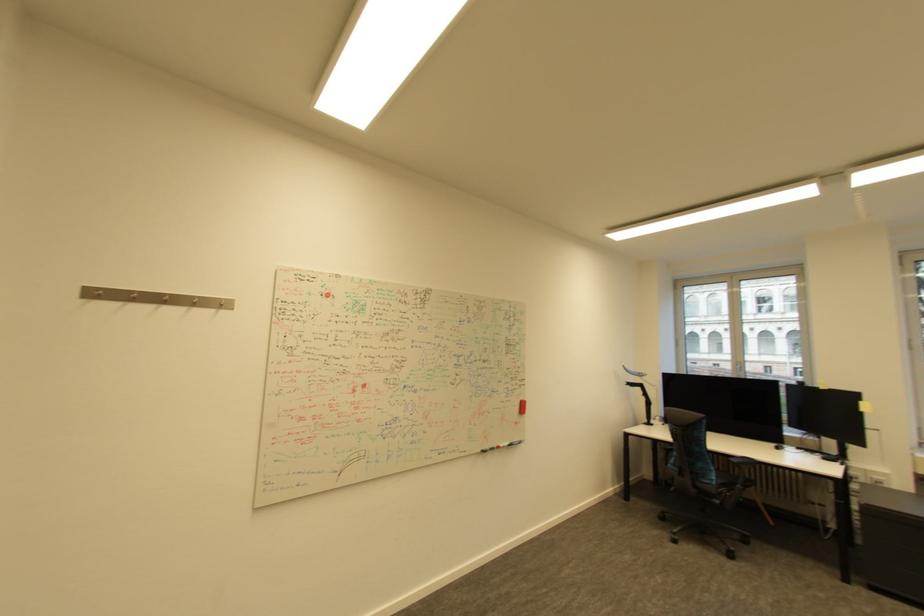
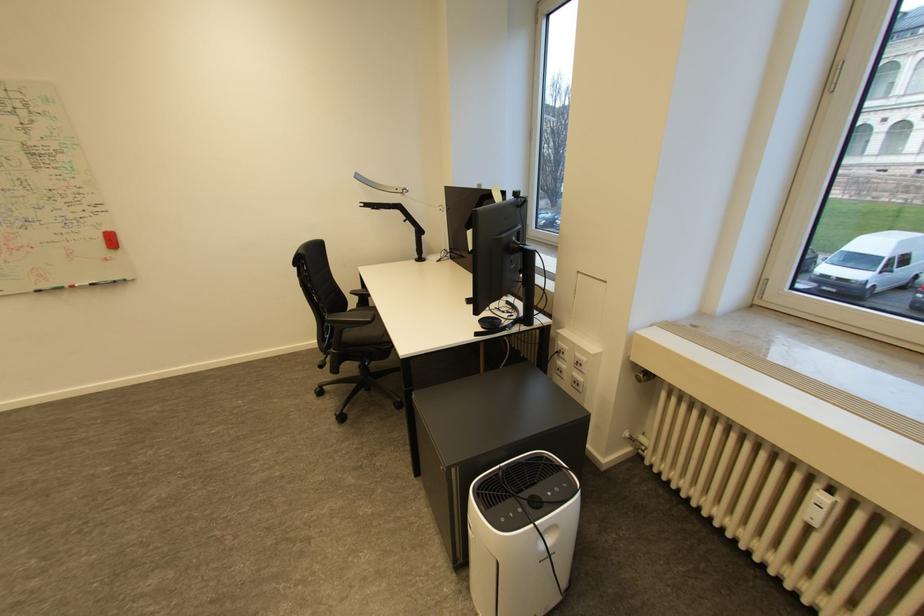
The point at (508, 446) is marked in the first image. Where is the corresponding point in the second image?

(83, 286)